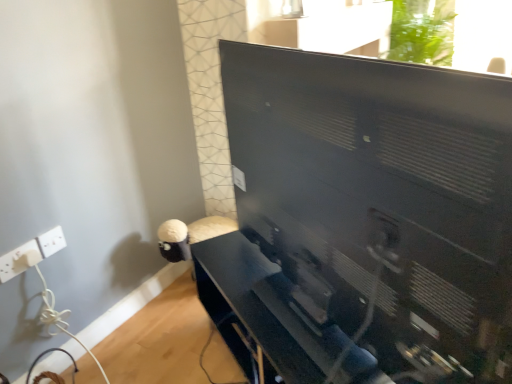
You are a GUI agent. You are given a task and a screenshot of the screen. Output one action in this format:
    pyautogui.click(x=<x>, y=<y>)
    Task: Click on the black matte computer monitor at center
    
    Given the screenshot: What is the action you would take?
    pyautogui.click(x=378, y=206)

What do you see at coordinates (264, 310) in the screenshot?
I see `matte black tv stand at center` at bounding box center [264, 310].

The image size is (512, 384). I want to click on black matte computer monitor at center, so click(378, 206).

From the image's perspective, which object appears higher, white plastic electric outlet at lower left, the 1th electric outlet when ordered from left to right, or black matte computer monitor at center?

black matte computer monitor at center is shown above in the image.

Is white plastic electric outlet at lower left, the 1th electric outlet when ordered from left to right, placed right next to black matte computer monitor at center?

No, white plastic electric outlet at lower left, the 1th electric outlet when ordered from left to right, is not making contact with black matte computer monitor at center.

Looking at this image, between white plastic electric outlet at lower left, the 2th electric outlet viewed from the right, and black matte computer monitor at center, which one has smaller size?

white plastic electric outlet at lower left, the 2th electric outlet viewed from the right, is smaller.

This screenshot has height=384, width=512. Identify the location of the 2nd electric outlet located beneath the black matte computer monitor at center (from a real-world perspective). (19, 260).

Considering the sizes of objects white plastic electric outlet at lower left, the 1th electric outlet viewed from the right, and white plastic electric outlet at lower left, the 2th electric outlet viewed from the right, in the image provided, who is thinner, white plastic electric outlet at lower left, the 1th electric outlet viewed from the right, or white plastic electric outlet at lower left, the 2th electric outlet viewed from the right,?

white plastic electric outlet at lower left, the 2th electric outlet viewed from the right, is thinner.

Where is `electric outlet above the white plastic electric outlet at lower left, the 2th electric outlet viewed from the right (from the image's perspective)`? electric outlet above the white plastic electric outlet at lower left, the 2th electric outlet viewed from the right (from the image's perspective) is located at coordinates (51, 241).

Is white plastic electric outlet at lower left, which is counted as the 2th electric outlet, starting from the left, positioned far away from white plastic electric outlet at lower left, the 2th electric outlet viewed from the right?

They are positioned close to each other.

From a real-world perspective, between white plastic electric outlet at lower left, which is counted as the 2th electric outlet, starting from the left, and white plastic electric outlet at lower left, the 1th electric outlet when ordered from left to right, who is vertically higher?

white plastic electric outlet at lower left, which is counted as the 2th electric outlet, starting from the left, is physically above.

Considering the relative positions of white plastic electric outlet at lower left, which is counted as the 2th electric outlet, starting from the left, and matte black tv stand at center in the image provided, is white plastic electric outlet at lower left, which is counted as the 2th electric outlet, starting from the left, behind matte black tv stand at center?

Yes, white plastic electric outlet at lower left, which is counted as the 2th electric outlet, starting from the left, is further from the viewer.

Starting from the matte black tv stand at center, which electric outlet is the 1st one to the left? Please provide its 2D coordinates.

[(51, 241)]

Is matte black tv stand at center at the back of white plastic electric outlet at lower left, which is counted as the 2th electric outlet, starting from the left?

That's not correct — white plastic electric outlet at lower left, which is counted as the 2th electric outlet, starting from the left, is not looking away from matte black tv stand at center.

Which of these two, white plastic electric outlet at lower left, the 1th electric outlet viewed from the right, or matte black tv stand at center, is bigger?

matte black tv stand at center.

In the scene shown: Considering the relative positions of black matte computer monitor at center and matte black tv stand at center in the image provided, is black matte computer monitor at center behind matte black tv stand at center?

No, black matte computer monitor at center is in front of matte black tv stand at center.

From the image's perspective, is black matte computer monitor at center above or below matte black tv stand at center?

Based on their image positions, black matte computer monitor at center is located above matte black tv stand at center.

Is black matte computer monitor at center not within matte black tv stand at center?

Yes, black matte computer monitor at center is located beyond the bounds of matte black tv stand at center.

From a real-world perspective, who is located lower, black matte computer monitor at center or matte black tv stand at center?

matte black tv stand at center.

Considering the relative positions of white plastic electric outlet at lower left, the 1th electric outlet when ordered from left to right, and matte black tv stand at center in the image provided, is white plastic electric outlet at lower left, the 1th electric outlet when ordered from left to right, to the left of matte black tv stand at center from the viewer's perspective?

Yes.

Does white plastic electric outlet at lower left, the 2th electric outlet viewed from the right, have a lesser width compared to matte black tv stand at center?

Correct, the width of white plastic electric outlet at lower left, the 2th electric outlet viewed from the right, is less than that of matte black tv stand at center.

Considering the positions of point (11, 269) and point (345, 343), is point (11, 269) closer or farther from the camera than point (345, 343)?

Point (11, 269) appears to be farther away from the viewer than point (345, 343).

Measure the distance between white plastic electric outlet at lower left, the 2th electric outlet viewed from the right, and matte black tv stand at center.

A distance of 30.33 inches exists between white plastic electric outlet at lower left, the 2th electric outlet viewed from the right, and matte black tv stand at center.

From a real-world perspective, which object stands above the other?

black matte computer monitor at center is physically above.

Considering the positions of objects matte black tv stand at center and black matte computer monitor at center in the image provided, who is more to the left, matte black tv stand at center or black matte computer monitor at center?

matte black tv stand at center is more to the left.

Considering the relative sizes of matte black tv stand at center and black matte computer monitor at center in the image provided, is matte black tv stand at center taller than black matte computer monitor at center?

Incorrect, the height of matte black tv stand at center is not larger of that of black matte computer monitor at center.

From the image's perspective, which is above, white plastic electric outlet at lower left, the 2th electric outlet viewed from the right, or white plastic electric outlet at lower left, which is counted as the 2th electric outlet, starting from the left?

white plastic electric outlet at lower left, which is counted as the 2th electric outlet, starting from the left, from the image's perspective.

Could you measure the distance between white plastic electric outlet at lower left, the 2th electric outlet viewed from the right, and white plastic electric outlet at lower left, which is counted as the 2th electric outlet, starting from the left?

white plastic electric outlet at lower left, the 2th electric outlet viewed from the right, is 2.90 inches from white plastic electric outlet at lower left, which is counted as the 2th electric outlet, starting from the left.

Can you confirm if white plastic electric outlet at lower left, the 2th electric outlet viewed from the right, is thinner than white plastic electric outlet at lower left, which is counted as the 2th electric outlet, starting from the left?

Indeed, white plastic electric outlet at lower left, the 2th electric outlet viewed from the right, has a lesser width compared to white plastic electric outlet at lower left, which is counted as the 2th electric outlet, starting from the left.

Based on their sizes in the image, would you say white plastic electric outlet at lower left, the 2th electric outlet viewed from the right, is bigger or smaller than white plastic electric outlet at lower left, the 1th electric outlet viewed from the right?

Clearly, white plastic electric outlet at lower left, the 2th electric outlet viewed from the right, is larger in size than white plastic electric outlet at lower left, the 1th electric outlet viewed from the right.

Identify the location of electric outlet that is the 2nd one below the black matte computer monitor at center (from a real-world perspective). Image resolution: width=512 pixels, height=384 pixels. (19, 260).

You are a GUI agent. You are given a task and a screenshot of the screen. Output one action in this format:
    pyautogui.click(x=<x>, y=<y>)
    Task: Click on the electric outlet on the left of white plastic electric outlet at lower left, which is counted as the 2th electric outlet, starting from the left
    
    Given the screenshot: What is the action you would take?
    pyautogui.click(x=19, y=260)

Based on their spatial positions, is white plastic electric outlet at lower left, the 2th electric outlet viewed from the right, or matte black tv stand at center closer to black matte computer monitor at center?

matte black tv stand at center is closer to black matte computer monitor at center.

Considering their positions, is black matte computer monitor at center positioned closer to white plastic electric outlet at lower left, the 1th electric outlet viewed from the right, than white plastic electric outlet at lower left, the 2th electric outlet viewed from the right?

white plastic electric outlet at lower left, the 2th electric outlet viewed from the right, is positioned closer to the anchor white plastic electric outlet at lower left, the 1th electric outlet viewed from the right.

Which object lies nearer to the anchor point white plastic electric outlet at lower left, which is counted as the 2th electric outlet, starting from the left, black matte computer monitor at center or matte black tv stand at center?

matte black tv stand at center lies closer to white plastic electric outlet at lower left, which is counted as the 2th electric outlet, starting from the left, than the other object.

Estimate the real-world distances between objects in this image. Which object is further from white plastic electric outlet at lower left, the 1th electric outlet viewed from the right, matte black tv stand at center or black matte computer monitor at center?

The object further to white plastic electric outlet at lower left, the 1th electric outlet viewed from the right, is black matte computer monitor at center.

Based on their spatial positions, is white plastic electric outlet at lower left, which is counted as the 2th electric outlet, starting from the left, or matte black tv stand at center closer to black matte computer monitor at center?

Result: matte black tv stand at center is positioned closer to the anchor black matte computer monitor at center.

When comparing their distances from black matte computer monitor at center, does matte black tv stand at center or white plastic electric outlet at lower left, the 2th electric outlet viewed from the right, seem closer?

Based on the image, matte black tv stand at center appears to be nearer to black matte computer monitor at center.

Estimate the real-world distances between objects in this image. Which object is closer to white plastic electric outlet at lower left, the 1th electric outlet viewed from the right, white plastic electric outlet at lower left, the 2th electric outlet viewed from the right, or black matte computer monitor at center?

The object closer to white plastic electric outlet at lower left, the 1th electric outlet viewed from the right, is white plastic electric outlet at lower left, the 2th electric outlet viewed from the right.

Considering their positions, is black matte computer monitor at center positioned further to white plastic electric outlet at lower left, the 1th electric outlet when ordered from left to right, than white plastic electric outlet at lower left, the 1th electric outlet viewed from the right?

black matte computer monitor at center lies further to white plastic electric outlet at lower left, the 1th electric outlet when ordered from left to right, than the other object.

What are the coordinates of `furniture between white plastic electric outlet at lower left, the 2th electric outlet viewed from the right, and black matte computer monitor at center from left to right` in the screenshot? It's located at (264, 310).

Find the location of a particular element. Image resolution: width=512 pixels, height=384 pixels. electric outlet between white plastic electric outlet at lower left, the 1th electric outlet when ordered from left to right, and matte black tv stand at center is located at coordinates (51, 241).

At what (x,y) coordinates should I click in order to perform the action: click on electric outlet positioned between black matte computer monitor at center and white plastic electric outlet at lower left, the 1th electric outlet viewed from the right, from near to far. Please return your answer as a coordinate pair (x, y). Looking at the image, I should click on (19, 260).

Find the location of a particular element. furniture located between white plastic electric outlet at lower left, which is counted as the 2th electric outlet, starting from the left, and black matte computer monitor at center in the left-right direction is located at coordinates (264, 310).